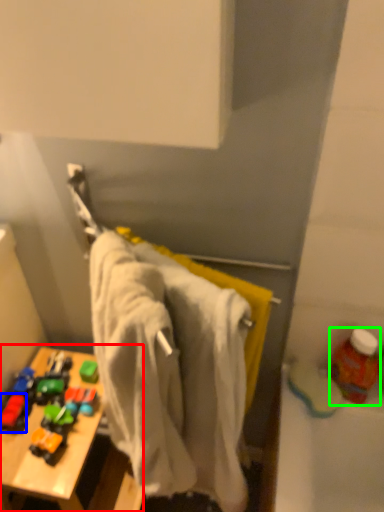
Question: Estimate the real-world distances between objects in this image. Which object is closer to table (highlighted by a red box), toy (highlighted by a blue box) or bottle (highlighted by a green box)?

Choices:
 (A) toy
 (B) bottle

Answer: (A)